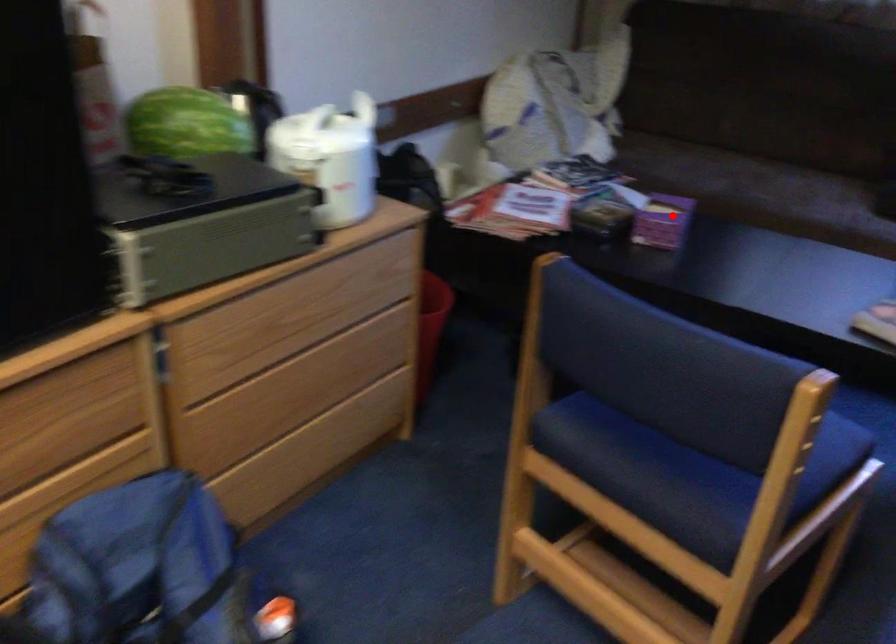
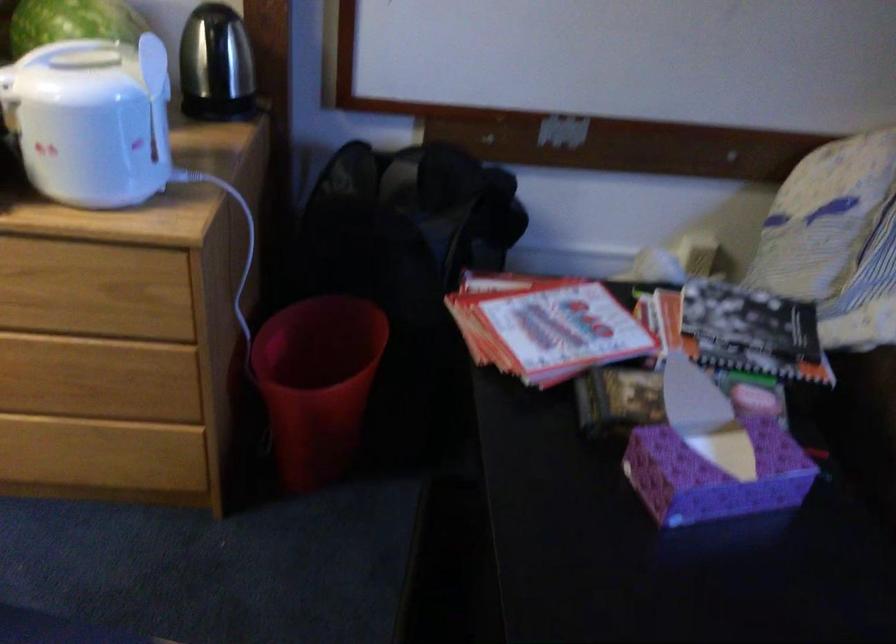
Question: I am providing you with two images of the same scene from different viewpoints. Image1 has a red point marked. In image2, the corresponding 3D location appears at what relative position? Reply with the corresponding letter.

Choices:
 (A) Closer
 (B) Farther

Answer: (A)